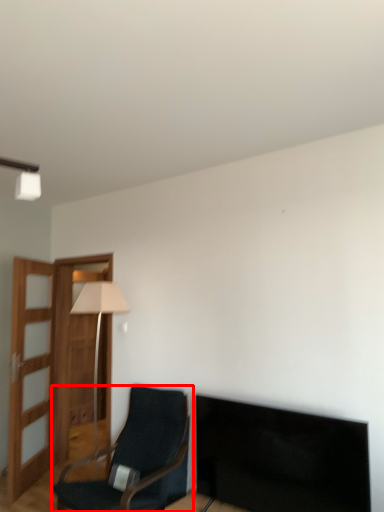
Question: In this image, where is chair (annotated by the red box) located relative to table lamp?

Choices:
 (A) right
 (B) left

Answer: (A)